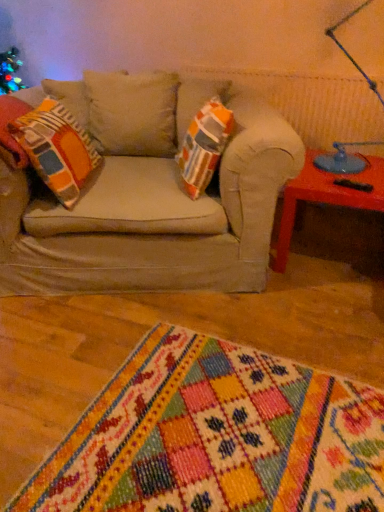
Identify the location of space that is in front of matte orange table at right. (317, 317).